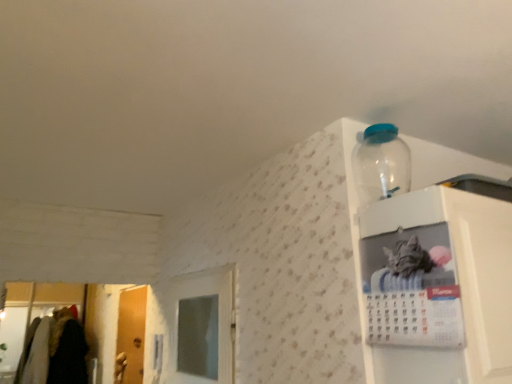
Question: Would you say white glossy calendar at upper right, which is the second cabinet from left to right, is inside or outside white glossy calendar at upper right, which is the second cabinet from right to left?

Choices:
 (A) outside
 (B) inside

Answer: (A)

Question: Visually, is white glossy calendar at upper right, which is the second cabinet from left to right, positioned to the left or to the right of white glossy calendar at upper right, which is the second cabinet from right to left?

Choices:
 (A) right
 (B) left

Answer: (A)

Question: Based on their relative distances, which object is farther from the wooden door at left?

Choices:
 (A) transparent plastic bottle at upper right
 (B) white glossy calendar at upper right, which is the second cabinet from left to right
 (C) white glossy calendar at upper right, which is the second cabinet from right to left

Answer: (B)

Question: Which of these objects is positioned farthest from the transparent plastic bottle at upper right?

Choices:
 (A) white glossy calendar at upper right, the first cabinet from the right
 (B) white glossy calendar at upper right, which is the second cabinet from right to left
 (C) wooden door at left

Answer: (C)